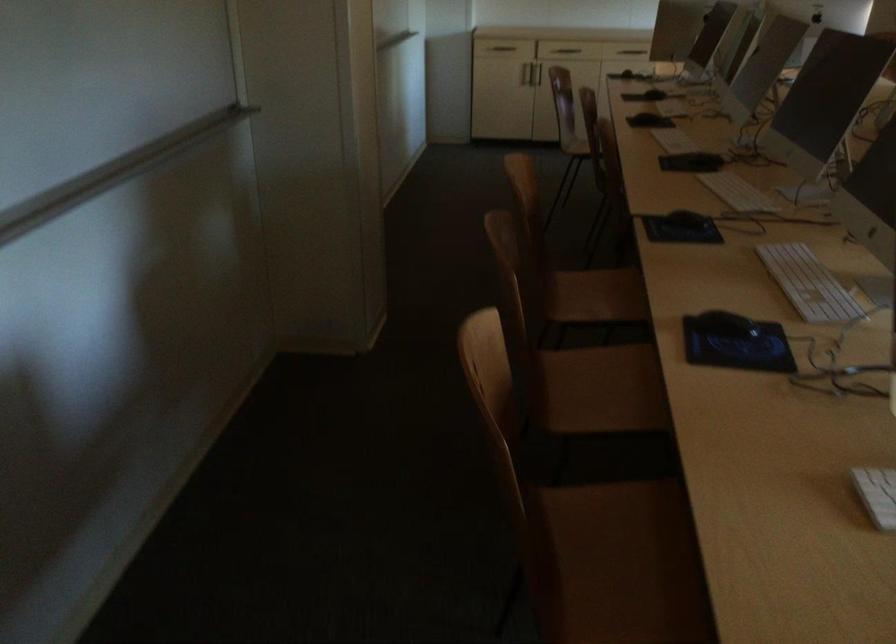
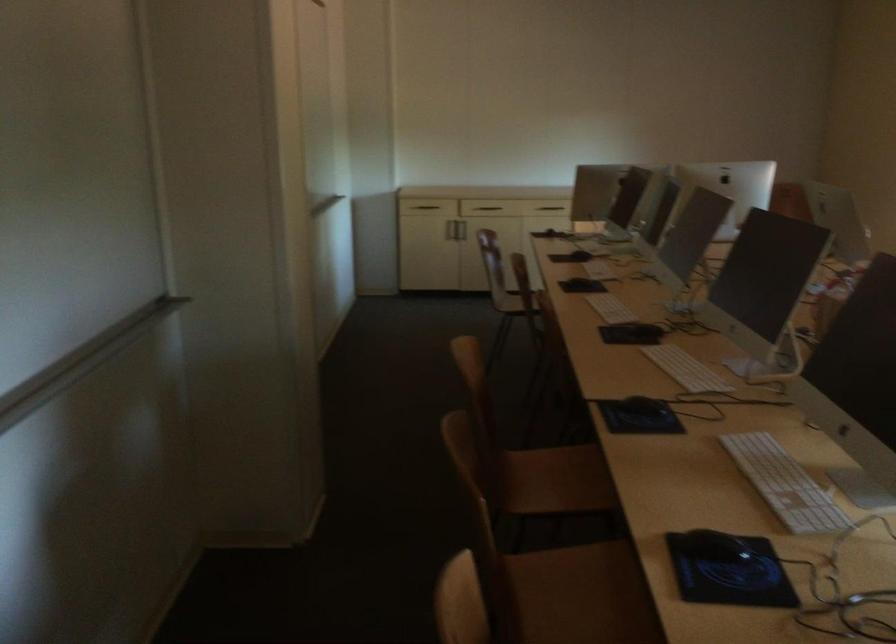
Based on the photo, which direction would the cameraman need to move to produce the second image?

The movement direction of the cameraman is left, forward.